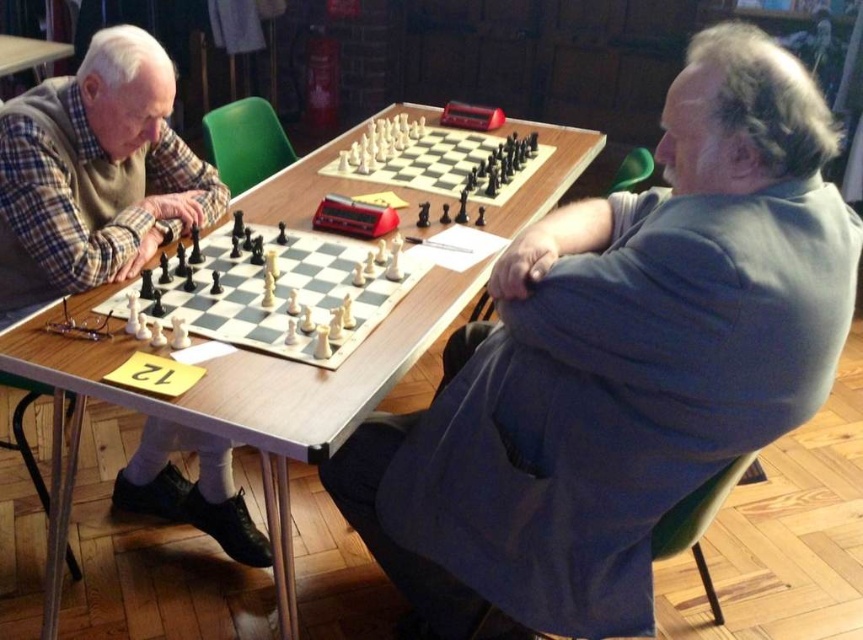
Question: Considering the relative positions of matte black chess set at left and wooden table at upper left in the image provided, where is matte black chess set at left located with respect to wooden table at upper left?

Choices:
 (A) below
 (B) above

Answer: (A)

Question: Does white plastic chess pieces at center have a lesser width compared to wooden table at upper left?

Choices:
 (A) yes
 (B) no

Answer: (B)

Question: Which object appears closest to the camera in this image?

Choices:
 (A) gray woolen jacket at right
 (B) white plastic chess set at center

Answer: (A)

Question: Which of the following is the farthest from the observer?

Choices:
 (A) white plastic chess set at center
 (B) wooden chessboard at center

Answer: (A)

Question: Which is nearer to the wooden table at upper left?

Choices:
 (A) matte black chess set at left
 (B) white plastic chess pieces at center
 (C) wooden chessboard at center
 (D) white plastic chess set at center

Answer: (A)

Question: Observing the image, what is the correct spatial positioning of wooden chessboard at center in reference to white plastic chess pieces at center?

Choices:
 (A) above
 (B) below

Answer: (A)